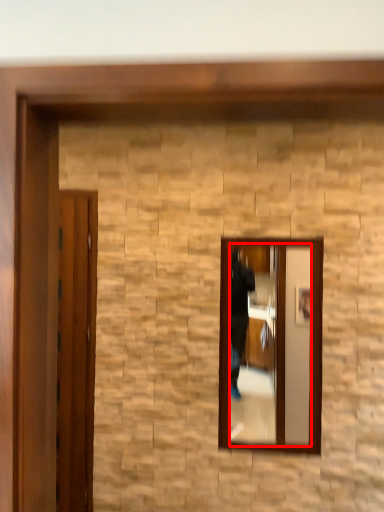
Question: Observing the image, what is the correct spatial positioning of mirror (annotated by the red box) in reference to door?

Choices:
 (A) left
 (B) right

Answer: (B)